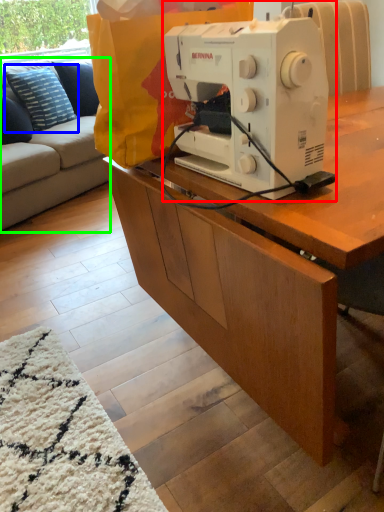
Question: Which is nearer to the sewing machine (highlighted by a red box)? pillow (highlighted by a blue box) or studio couch (highlighted by a green box).

Choices:
 (A) pillow
 (B) studio couch

Answer: (B)